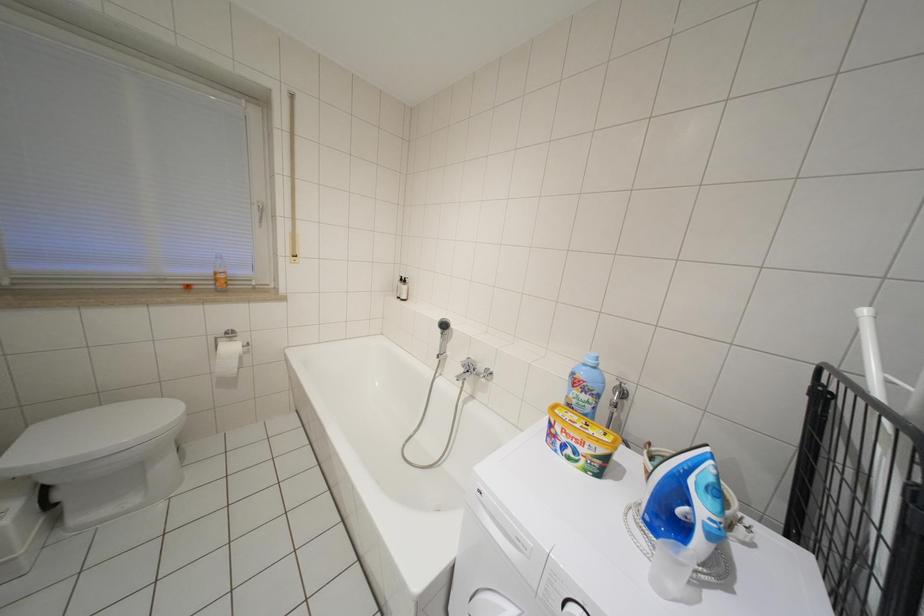
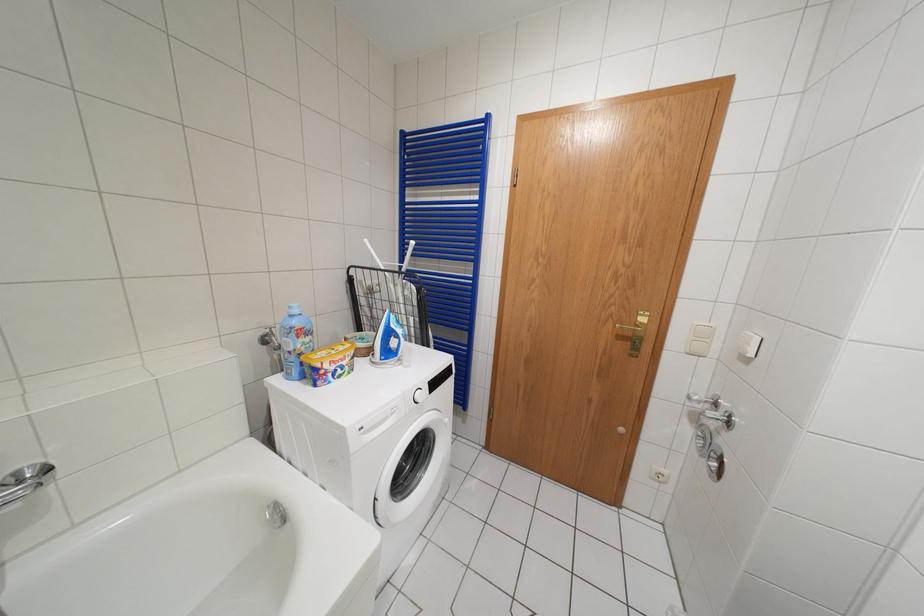
First-person continuous shooting, in which direction is the camera rotating?

The camera rotated toward right-down.